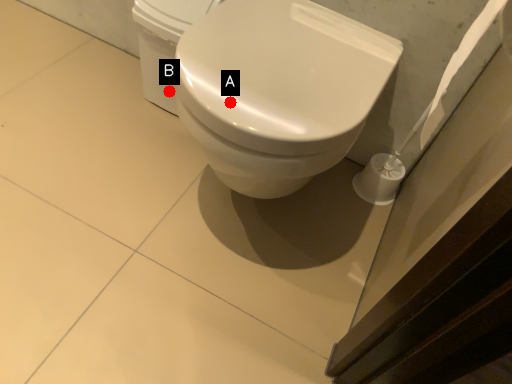
Question: Two points are circled on the image, labeled by A and B beside each circle. Which point appears farthest from the camera in this image?

Choices:
 (A) A is further
 (B) B is further

Answer: (B)